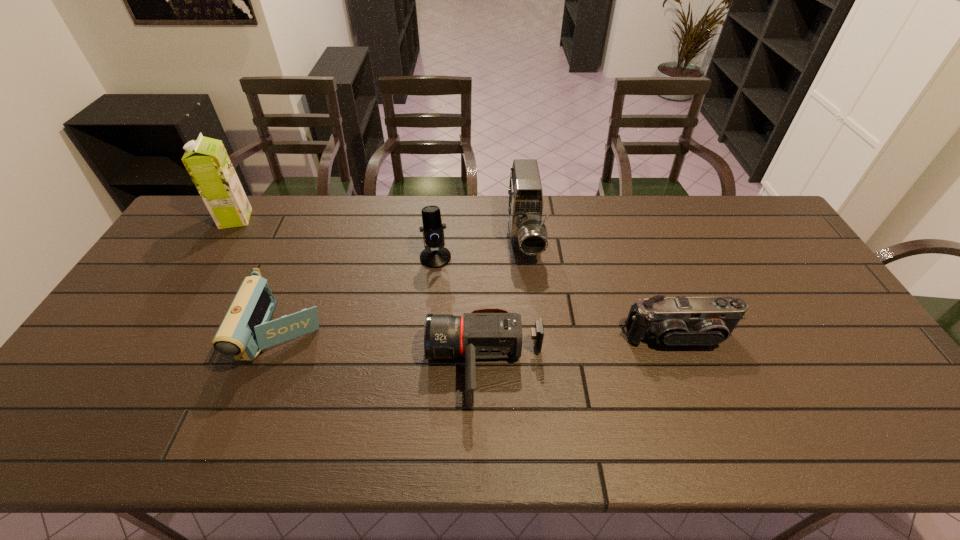
At what (x,y) coordinates should I click in order to perform the action: click on free space between the tallest camcorder and the rightmost camcorder. Please return your answer as a coordinate pair (x, y). Looking at the image, I should click on (601, 288).

Identify the location of blank region between the tallest object and the fourth shortest object. Image resolution: width=960 pixels, height=540 pixels. (336, 238).

You are a GUI agent. You are given a task and a screenshot of the screen. Output one action in this format:
    pyautogui.click(x=<x>, y=<y>)
    Task: Click on the free spot between the tallest camcorder and the rightmost object
    
    Given the screenshot: What is the action you would take?
    pyautogui.click(x=601, y=288)

The height and width of the screenshot is (540, 960). In order to click on empty location between the shortest object and the second object from left to right in this screenshot , I will do `click(384, 350)`.

Find the location of a particular element. free space between the shortest object and the rightmost object is located at coordinates (581, 351).

Identify the location of vacant area between the microphone and the shortest object. (460, 311).

Where is `free space between the third tallest object and the leftmost camcorder`? The image size is (960, 540). free space between the third tallest object and the leftmost camcorder is located at coordinates (360, 296).

This screenshot has height=540, width=960. In order to click on object that is the third closest to the microphone in this screenshot , I will do `click(246, 329)`.

Find the location of a particular element. The height and width of the screenshot is (540, 960). object that is the nearest to the soya milk is located at coordinates (246, 329).

Point out which camcorder is positioned as the second nearest to the rightmost camcorder. Please provide its 2D coordinates. Your answer should be formatted as a tuple, i.e. [(x, y)], where the tuple contains the x and y coordinates of a point satisfying the conditions above.

[(528, 233)]